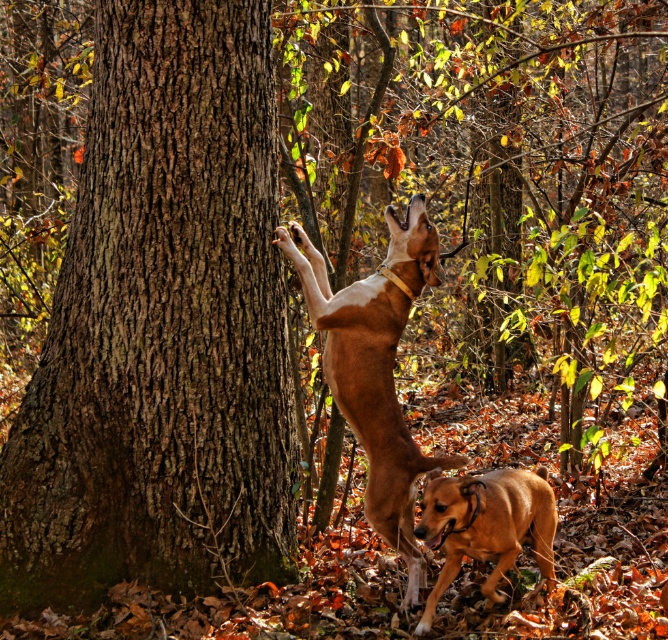
You are a hiker who wants to take a photo of the brown rough bark at center and the brown glossy dog at center. Since you have a camera with a fixed focal length, you need to know which object is bigger to adjust the focus. Which one is larger?

The brown rough bark at center is larger in size than the brown glossy dog at center, so you should adjust the focus for the brown rough bark at center.